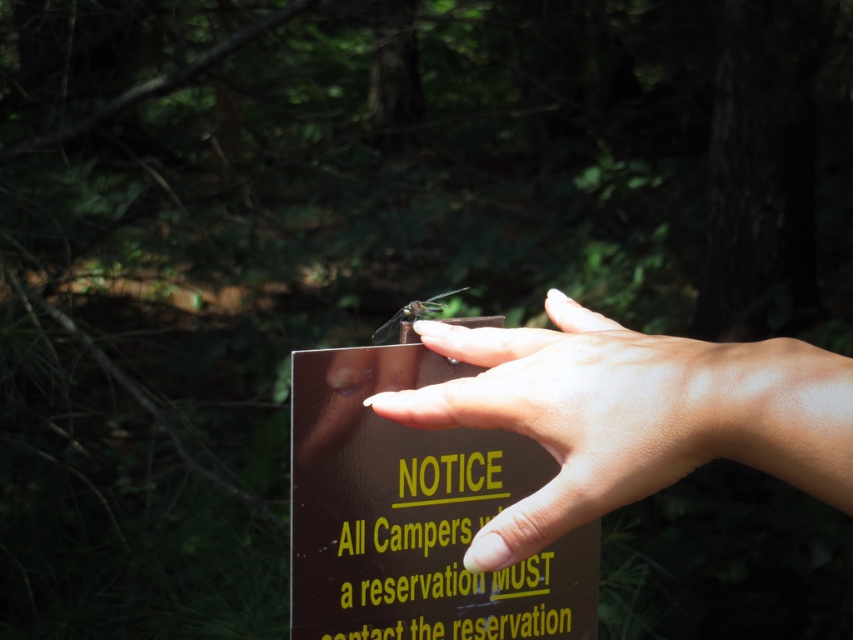
Is brown glossy sign at center to the left of smooth brown hand at center from the viewer's perspective?

Correct, you'll find brown glossy sign at center to the left of smooth brown hand at center.

Looking at this image, does brown glossy sign at center appear on the right side of smooth brown hand at center?

In fact, brown glossy sign at center is to the left of smooth brown hand at center.

Locate an element on the screen. The height and width of the screenshot is (640, 853). brown glossy sign at center is located at coordinates (415, 515).

Can you confirm if brown glossy sign at center is positioned to the left of translucent brown dragonfly at center?

No, brown glossy sign at center is not to the left of translucent brown dragonfly at center.

Can you confirm if brown glossy sign at center is positioned above translucent brown dragonfly at center?

No, brown glossy sign at center is not above translucent brown dragonfly at center.

Which is behind, point (334, 442) or point (439, 310)?

The point (439, 310) is more distant.

Where is `brown glossy sign at center`? The image size is (853, 640). brown glossy sign at center is located at coordinates (415, 515).

Which of these two, smooth brown hand at center or translucent brown dragonfly at center, stands shorter?

Standing shorter between the two is translucent brown dragonfly at center.

Is point (640, 410) positioned in front of point (425, 316)?

Yes, it is.

The height and width of the screenshot is (640, 853). What do you see at coordinates (578, 413) in the screenshot? I see `smooth brown hand at center` at bounding box center [578, 413].

Where is `smooth brown hand at center`? The image size is (853, 640). smooth brown hand at center is located at coordinates (578, 413).